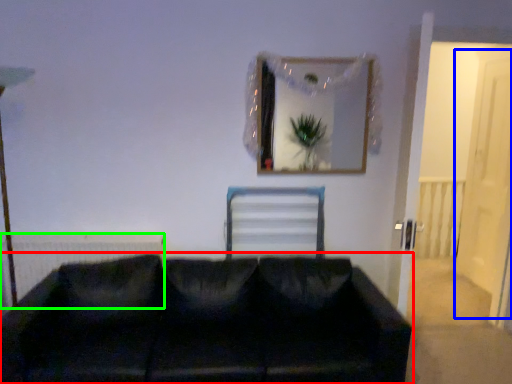
Question: Estimate the real-world distances between objects in this image. Which object is farther from studio couch (highlighted by a red box), glass door (highlighted by a blue box) or radiator (highlighted by a green box)?

Choices:
 (A) glass door
 (B) radiator

Answer: (A)